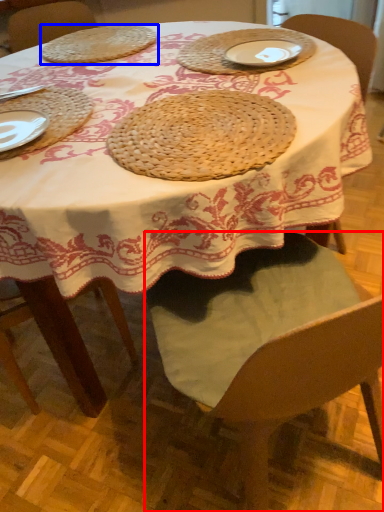
Question: Among these objects, which one is farthest to the camera, chair (highlighted by a red box) or pie (highlighted by a blue box)?

Choices:
 (A) chair
 (B) pie

Answer: (B)